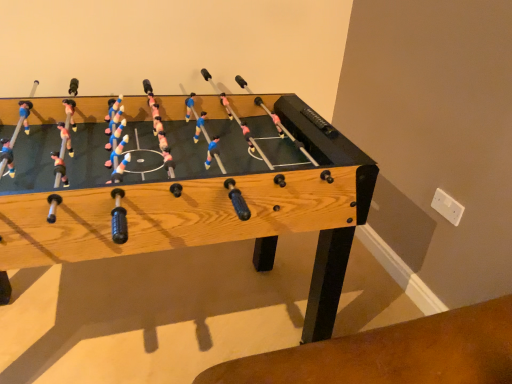
Where is `wooden foosball table at center`? This screenshot has height=384, width=512. wooden foosball table at center is located at coordinates (186, 190).

Describe the element at coordinates (186, 190) in the screenshot. I see `wooden foosball table at center` at that location.

You are a GUI agent. You are given a task and a screenshot of the screen. Output one action in this format:
    pyautogui.click(x=<x>, y=<y>)
    Task: Click on the wooden foosball table at center
    The height and width of the screenshot is (384, 512).
    Given the screenshot: What is the action you would take?
    pyautogui.click(x=186, y=190)